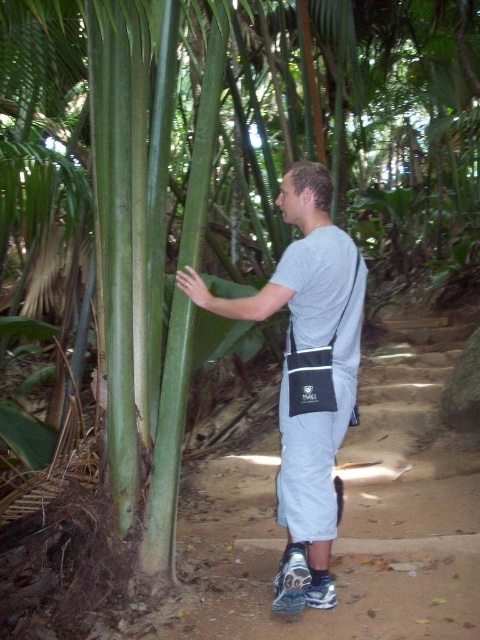
Question: Which object appears closest to the camera in this image?

Choices:
 (A) gray fabric shirt at center
 (B) gray fabric bag at center

Answer: (A)

Question: Which point appears closest to the camera in this image?

Choices:
 (A) (278, 483)
 (B) (177, 273)

Answer: (A)

Question: Among these points, which one is farthest from the camera?

Choices:
 (A) (307, 604)
 (B) (276, 484)

Answer: (B)

Question: Is gray fabric shirt at center positioned at the back of gray fabric bag at center?

Choices:
 (A) yes
 (B) no

Answer: (B)

Question: Does gray fabric shirt at center have a greater width compared to gray fabric bag at center?

Choices:
 (A) yes
 (B) no

Answer: (A)

Question: Can you confirm if gray fabric shirt at center is smaller than gray fabric bag at center?

Choices:
 (A) yes
 (B) no

Answer: (B)